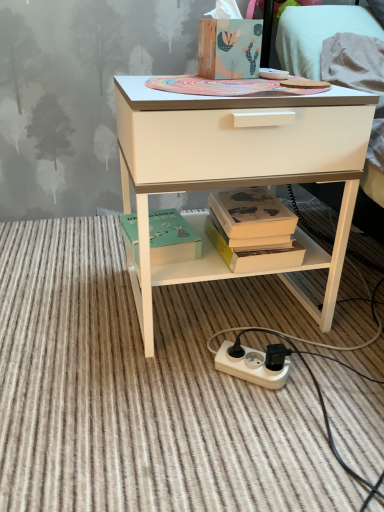
Find the location of `vacant space to the left of white matte desk at center`. vacant space to the left of white matte desk at center is located at coordinates (70, 298).